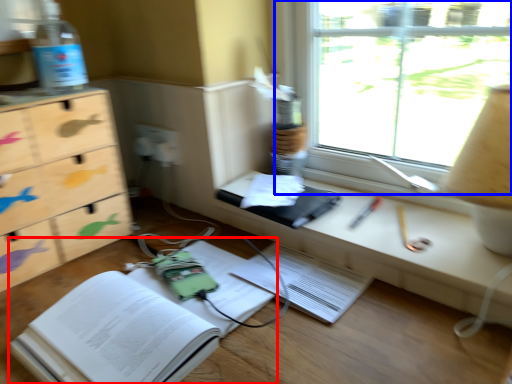
Question: Which point is closer to the camera, paperback book (highlighted by a red box) or window (highlighted by a blue box)?

Choices:
 (A) paperback book
 (B) window

Answer: (A)